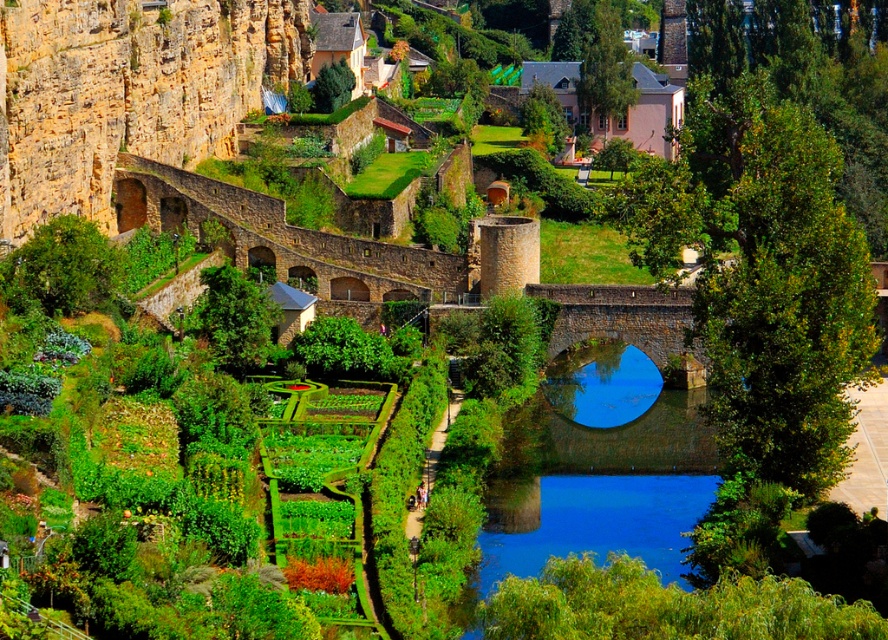
You are standing at the center of the stone bridge and see two points in the scene, point (161, 68) and point (555, 371). Which point is closer to you?

Point (161, 68) is closer to you because it is further to the viewer than point (555, 371).